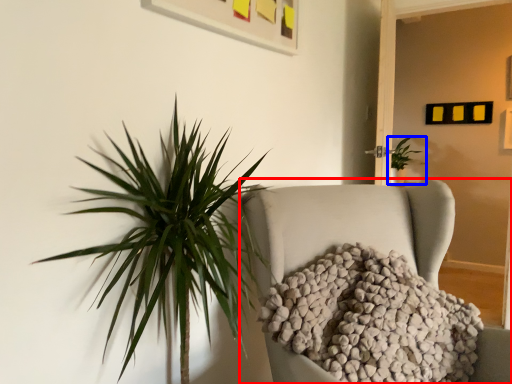
Question: Which object is further to the camera taking this photo, furniture (highlighted by a red box) or houseplant (highlighted by a blue box)?

Choices:
 (A) furniture
 (B) houseplant

Answer: (B)